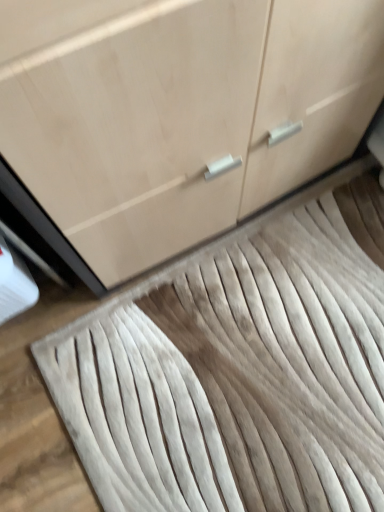
The image size is (384, 512). I want to click on free spot above white textured rug at center (from a real-world perspective), so click(264, 362).